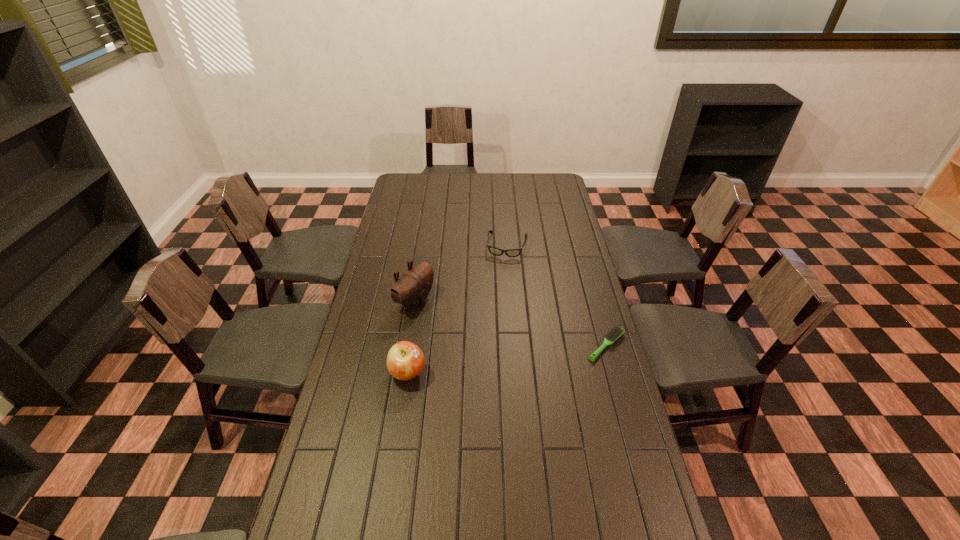
Where is `vacant area that satisfies the following two spatial constraints: 1. on the back side of the pouch; 2. on the right side of the third tallest object`? The image size is (960, 540). vacant area that satisfies the following two spatial constraints: 1. on the back side of the pouch; 2. on the right side of the third tallest object is located at coordinates (424, 246).